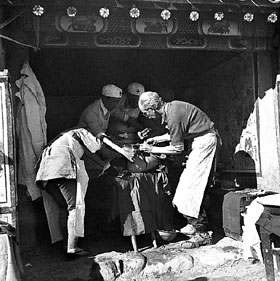
You are a GUI agent. You are given a task and a screenshot of the screen. Output one action in this format:
    pyautogui.click(x=<x>, y=<y>)
    Task: Click on the table
    This screenshot has width=280, height=281.
    Given the screenshot: What is the action you would take?
    pyautogui.click(x=128, y=201)